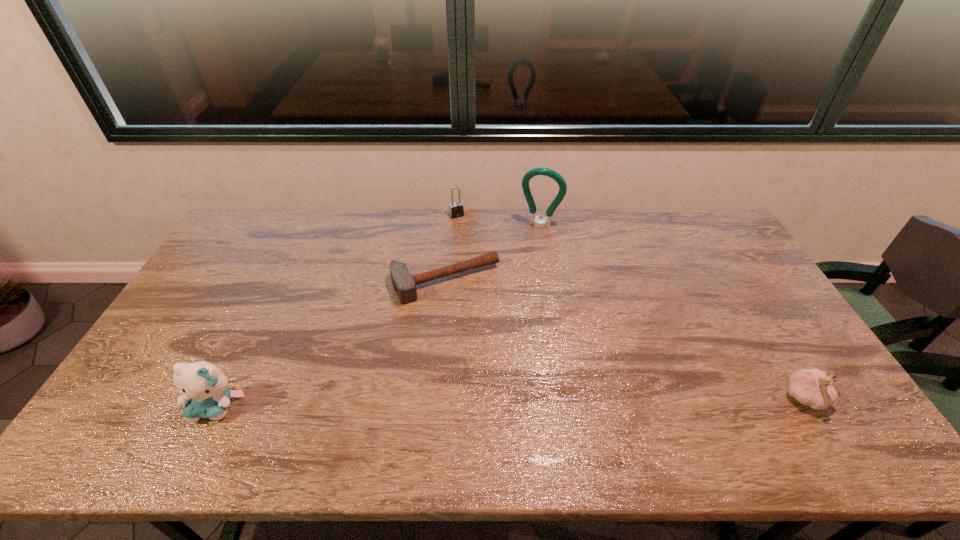
Find the location of a particular element. The height and width of the screenshot is (540, 960). the leftmost object is located at coordinates (204, 387).

This screenshot has width=960, height=540. Identify the location of the fourth shortest object. (204, 387).

Identify the location of garlic. The width and height of the screenshot is (960, 540). (811, 387).

At what (x,y) coordinates should I click in order to perform the action: click on hammer. Please return your answer as a coordinate pair (x, y). The height and width of the screenshot is (540, 960). Looking at the image, I should click on (404, 284).

Locate an element on the screen. the shortest object is located at coordinates (404, 284).

At what (x,y) coordinates should I click in order to perform the action: click on the tallest object. Please return your answer as a coordinate pair (x, y). The height and width of the screenshot is (540, 960). Looking at the image, I should click on (545, 222).

The height and width of the screenshot is (540, 960). Identify the location of bottle opener. (545, 222).

Locate an element on the screen. The image size is (960, 540). padlock is located at coordinates (456, 209).

I want to click on blank area located 0.110m on the left of the garlic, so click(741, 397).

Image resolution: width=960 pixels, height=540 pixels. I want to click on vacant position located 0.250m on the striking surface of the hammer, so click(502, 364).